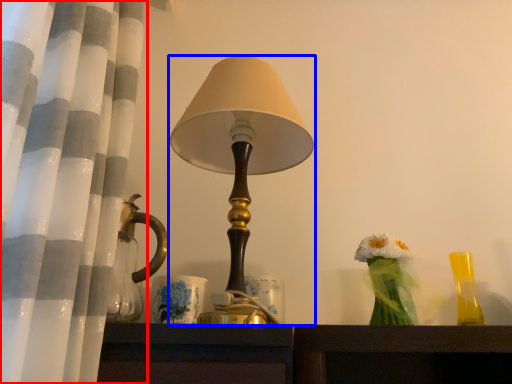
Question: Which point is further to the camera, curtain (highlighted by a red box) or lamp (highlighted by a blue box)?

Choices:
 (A) curtain
 (B) lamp

Answer: (B)